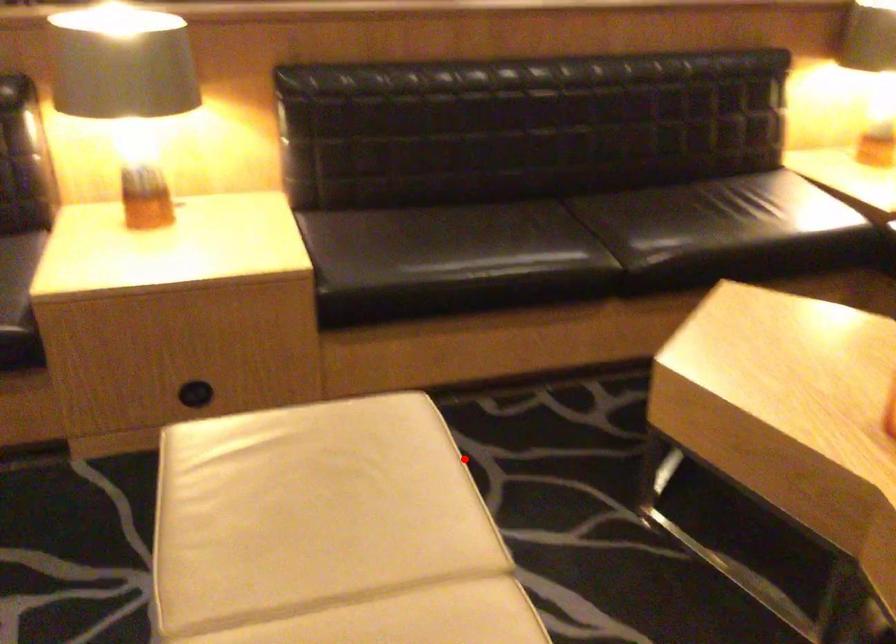
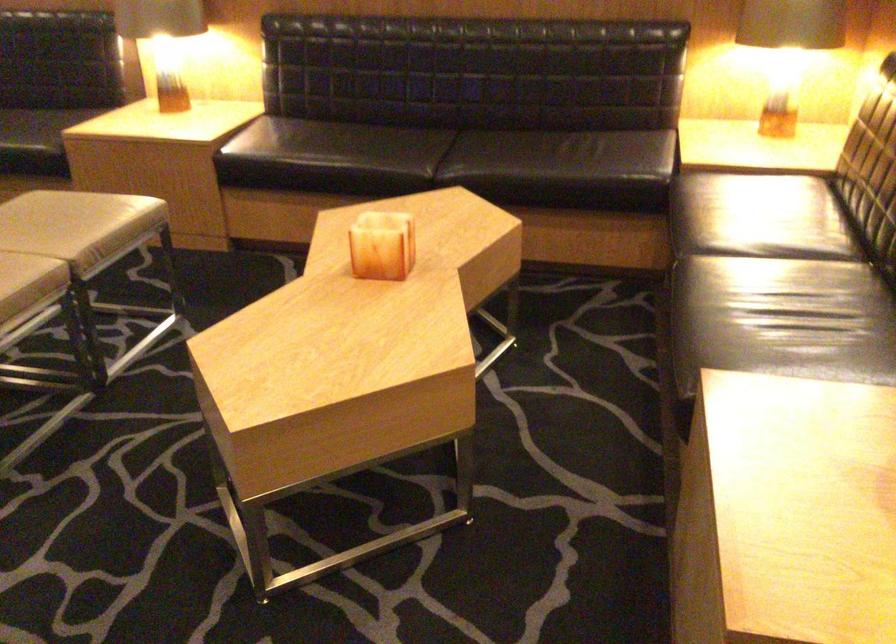
Question: I am providing you with two images of the same scene from different viewpoints. Image1 has a red point marked. In image2, the corresponding 3D location appears at what relative position? Reply with the corresponding letter.

Choices:
 (A) Closer
 (B) Farther

Answer: (B)